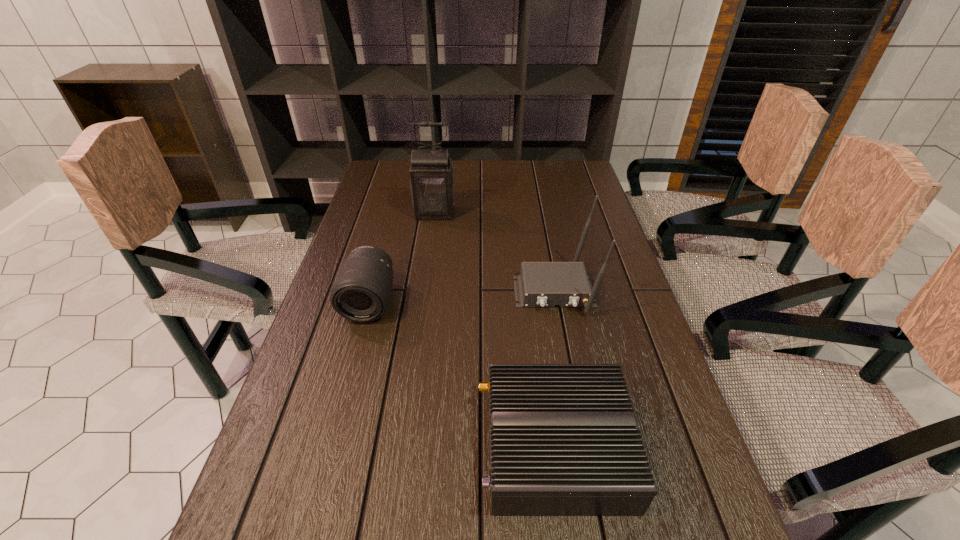
The image size is (960, 540). Identify the location of free region located on the surface of the telephoto lens. (324, 468).

Locate an element on the screen. This screenshot has height=540, width=960. vacant space positioned on the back panel of the nearest object is located at coordinates (443, 447).

At what (x,y) coordinates should I click in order to perform the action: click on vacant space situated on the back panel of the nearest object. Please return your answer as a coordinate pair (x, y). Looking at the image, I should click on (345, 447).

I want to click on vacant space situated 0.160m on the back panel of the nearest object, so click(x=396, y=447).

Find the location of a particular element. This screenshot has height=540, width=960. object at the left edge is located at coordinates (361, 292).

Identify the location of vacant space at the left edge of the desktop. (329, 342).

At what (x,y) coordinates should I click in order to perform the action: click on vacant space at the right edge. Please return your answer as a coordinate pair (x, y). Looking at the image, I should click on (575, 232).

Locate an element on the screen. vacant point at the far left corner is located at coordinates (373, 174).

Where is `vacant space at the far right corner of the desktop`? vacant space at the far right corner of the desktop is located at coordinates (574, 185).

Where is `vacant region between the third shortest object and the second shortest object`? Image resolution: width=960 pixels, height=540 pixels. vacant region between the third shortest object and the second shortest object is located at coordinates (462, 296).